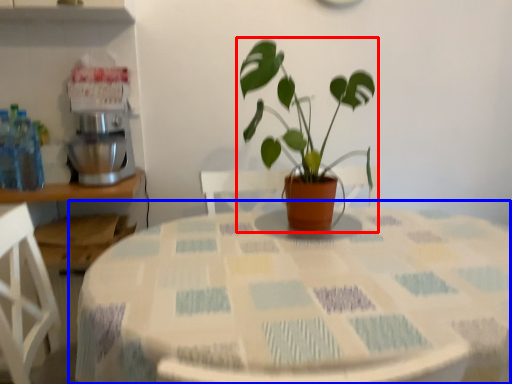
Question: Among these objects, which one is nearest to the camera, houseplant (highlighted by a red box) or table (highlighted by a blue box)?

Choices:
 (A) houseplant
 (B) table

Answer: (B)